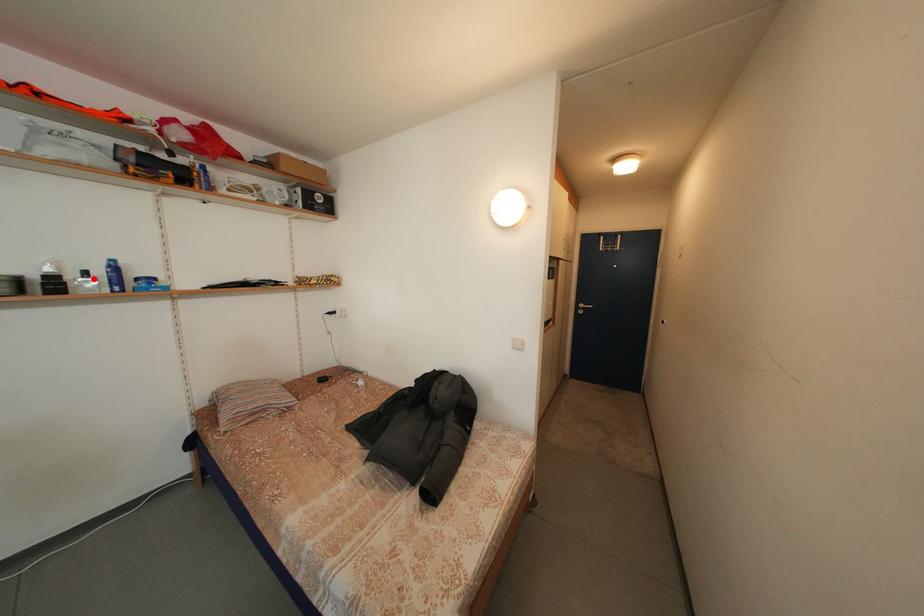
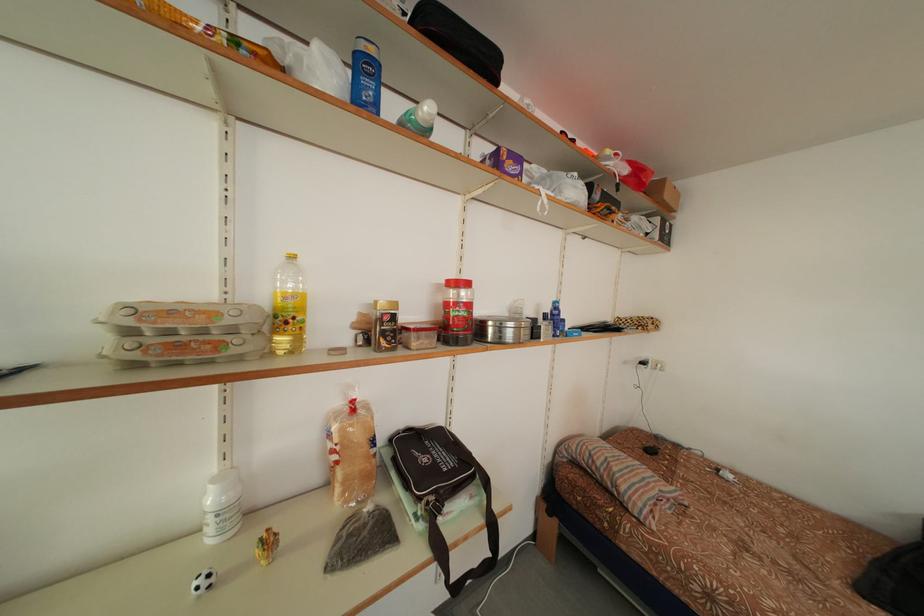
Where in the second image is the point corresponding to the highlighted location from the first image?

(553, 322)